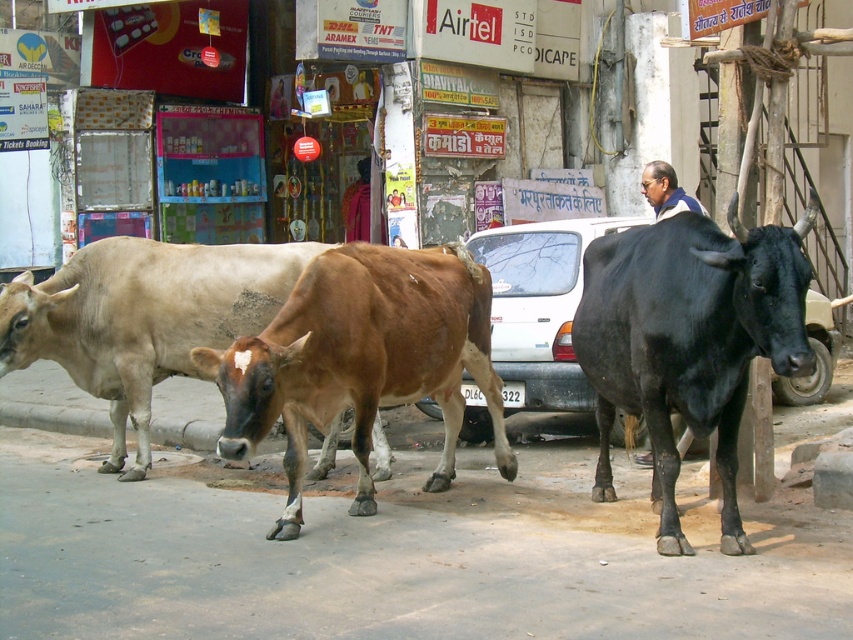
Is point (796, 380) farther from viewer compared to point (643, 179)?

Yes, point (796, 380) is farther from viewer.

Locate an element on the screen. white matte car at center is located at coordinates (538, 307).

Is white matte car at center to the left of blue and white shirt at center from the viewer's perspective?

Indeed, white matte car at center is positioned on the left side of blue and white shirt at center.

Does white matte car at center have a lesser height compared to blue and white shirt at center?

No.

Is point (781, 380) positioned before point (665, 177)?

No, (781, 380) is behind (665, 177).

Locate an element on the screen. white matte car at center is located at coordinates (538, 307).

Can you confirm if brown matte cow at center is positioned above white matte car at center?

No.

Is point (103, 355) less distant than point (572, 282)?

Yes, it is.

Image resolution: width=853 pixels, height=640 pixels. Identify the location of brown matte cow at center. (142, 317).